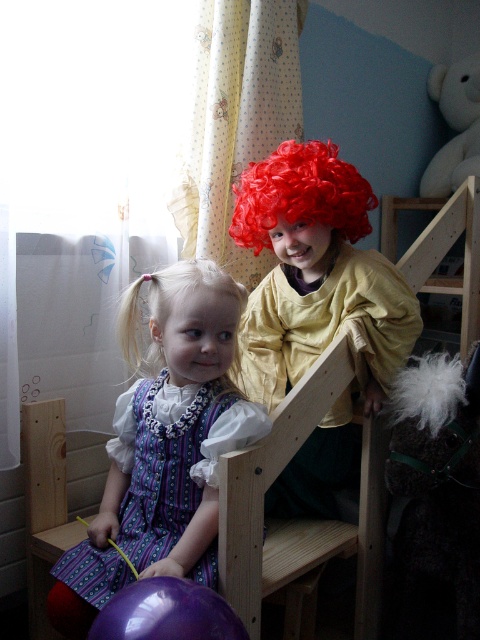
Question: Can you confirm if patterned fabric dress at center is thinner than curly red wig at upper center?

Choices:
 (A) yes
 (B) no

Answer: (B)

Question: Which point is farther to the camera?

Choices:
 (A) blonde silky hair at lower left
 (B) wooden chair at center

Answer: (A)

Question: Estimate the real-world distances between objects in this image. Which object is closer to the patterned fabric dress at center?

Choices:
 (A) curly red wig at upper right
 (B) blonde silky hair at lower left
 (C) white plush bear at upper right
 (D) purple glossy balloon at lower left

Answer: (B)

Question: Does wooden chair at center appear over patterned fabric dress at center?

Choices:
 (A) yes
 (B) no

Answer: (B)

Question: Estimate the real-world distances between objects in this image. Which object is closer to the blonde silky hair at lower left?

Choices:
 (A) purple glossy balloon at lower left
 (B) wooden chair at center
 (C) curly red wig at upper right
 (D) patterned fabric dress at center

Answer: (D)

Question: Is curly red wig at upper right positioned behind blonde silky hair at lower left?

Choices:
 (A) no
 (B) yes

Answer: (B)